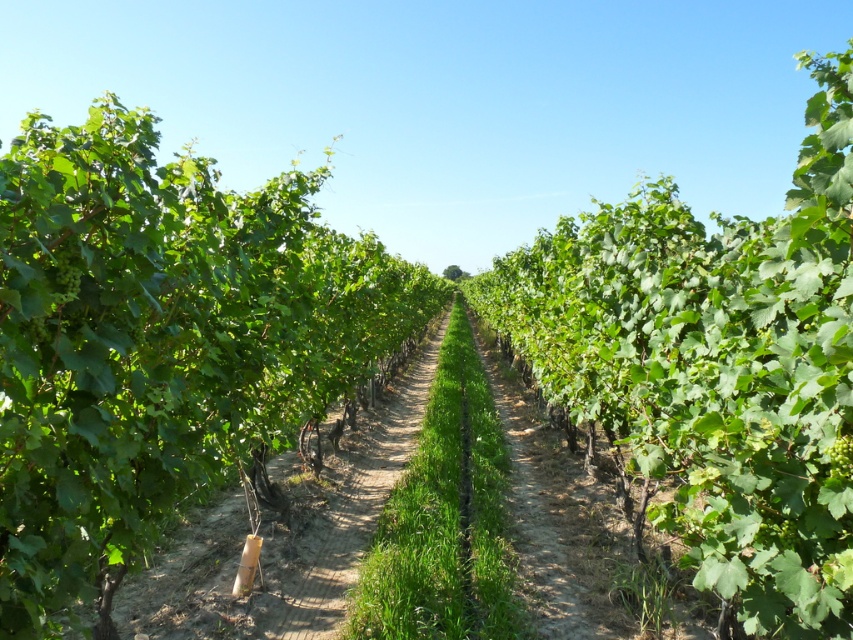
Question: Can you confirm if green grass at center is wider than green matte grape at center?

Choices:
 (A) no
 (B) yes

Answer: (B)

Question: Does green grass at center appear over green matte grape at left?

Choices:
 (A) no
 (B) yes

Answer: (A)

Question: Among these objects, which one is nearest to the camera?

Choices:
 (A) green matte grape at center
 (B) green matte grape at left

Answer: (B)

Question: Estimate the real-world distances between objects in this image. Which object is farther from the green matte grape at center?

Choices:
 (A) green matte grape at left
 (B) green grass at center

Answer: (B)

Question: Which point appears closest to the camera in this image?

Choices:
 (A) click(836, 448)
 (B) click(387, 467)
 (C) click(56, 291)

Answer: (A)

Question: Does green grass at center come in front of green matte grape at left?

Choices:
 (A) yes
 (B) no

Answer: (B)